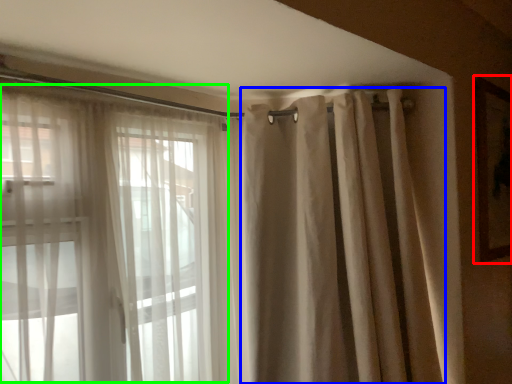
Question: Which object is positioned closest to picture frame (highlighted by a red box)? Select from shower curtain (highlighted by a blue box) and bay window (highlighted by a green box).

Choices:
 (A) shower curtain
 (B) bay window

Answer: (A)